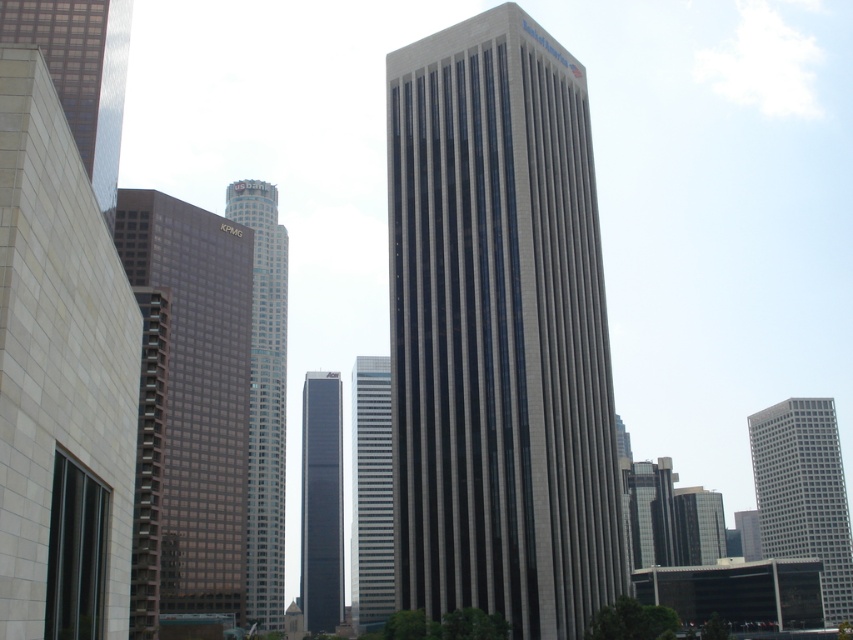
Question: Which object is positioned closest to the gray stone skyscraper at center?

Choices:
 (A) white stone building at left
 (B) black glass tower at center

Answer: (A)

Question: Estimate the real-world distances between objects in this image. Which object is closer to the white glass skyscraper at right?

Choices:
 (A) reflective glass skyscraper at left
 (B) glassy brown skyscraper at center

Answer: (B)

Question: Is brown glassy building at center in front of black glass tower at center?

Choices:
 (A) yes
 (B) no

Answer: (A)

Question: Is the position of white stone building at left more distant than that of white glass skyscraper at right?

Choices:
 (A) yes
 (B) no

Answer: (B)

Question: Which point appears closest to the camera in this image?

Choices:
 (A) [x=224, y=257]
 (B) [x=340, y=538]
 (C) [x=567, y=208]

Answer: (C)

Question: Can you confirm if brown glassy building at center is positioned to the right of glassy brown skyscraper at center?

Choices:
 (A) yes
 (B) no

Answer: (A)